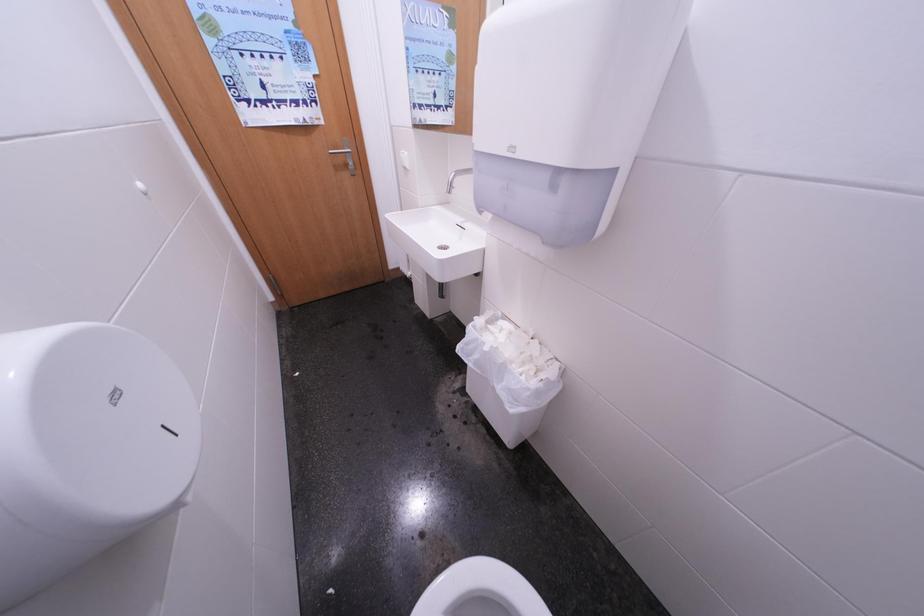
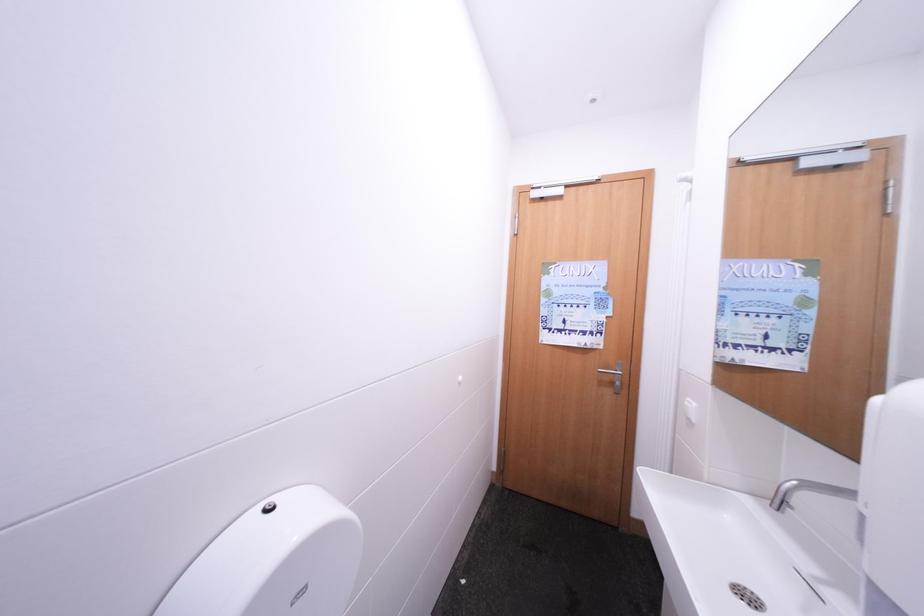
The first image is from the beginning of the video and the second image is from the end. How did the camera likely rotate when shooting the video?

The rotation direction of the camera is left-up.